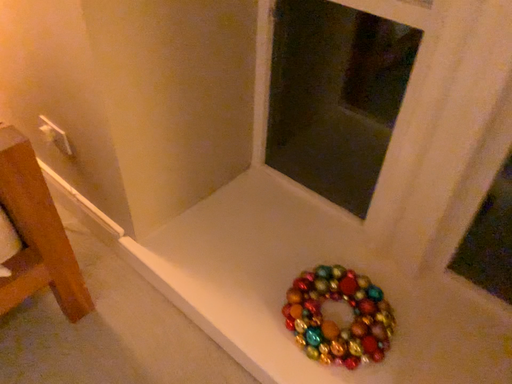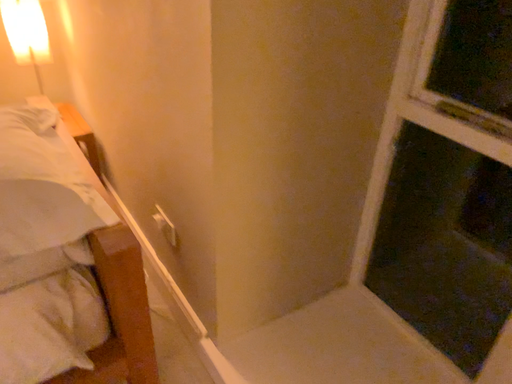
Question: Which way did the camera rotate in the video?

Choices:
 (A) rotated left
 (B) rotated right

Answer: (A)